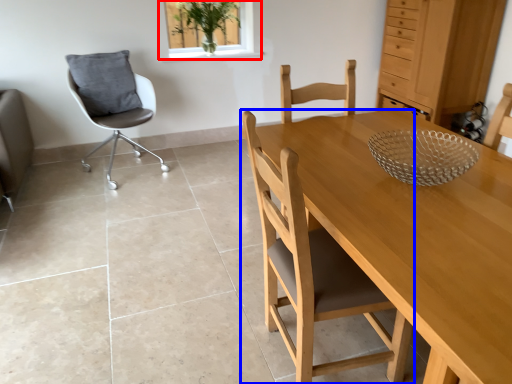
Question: Which object appears farthest to the camera in this image, window (highlighted by a red box) or chair (highlighted by a blue box)?

Choices:
 (A) window
 (B) chair

Answer: (A)